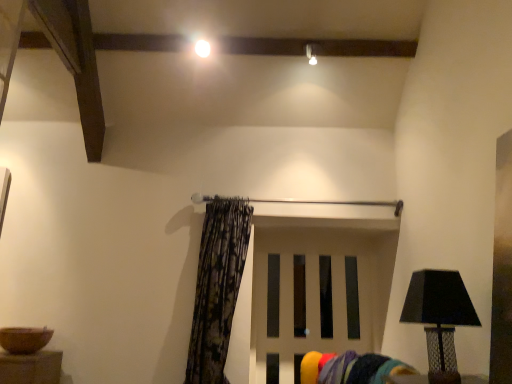
Question: Is black textured lamp at right turned away from velvet yellow swivel chair at lower center?

Choices:
 (A) yes
 (B) no

Answer: (B)

Question: From the image's perspective, is black textured lamp at right under velvet yellow swivel chair at lower center?

Choices:
 (A) no
 (B) yes

Answer: (A)

Question: Considering the relative sizes of black textured lamp at right and velvet yellow swivel chair at lower center in the image provided, is black textured lamp at right shorter than velvet yellow swivel chair at lower center?

Choices:
 (A) yes
 (B) no

Answer: (B)

Question: Considering the relative positions of black textured lamp at right and velvet yellow swivel chair at lower center in the image provided, is black textured lamp at right behind velvet yellow swivel chair at lower center?

Choices:
 (A) no
 (B) yes

Answer: (A)

Question: From a real-world perspective, is black textured lamp at right located higher than velvet yellow swivel chair at lower center?

Choices:
 (A) yes
 (B) no

Answer: (A)

Question: From a real-world perspective, is white matte door at center physically located above or below printed fabric curtain at center?

Choices:
 (A) below
 (B) above

Answer: (A)

Question: Looking at the image, does white matte door at center seem bigger or smaller compared to printed fabric curtain at center?

Choices:
 (A) small
 (B) big

Answer: (A)

Question: Considering the positions of white matte door at center and printed fabric curtain at center in the image, is white matte door at center taller or shorter than printed fabric curtain at center?

Choices:
 (A) tall
 (B) short

Answer: (B)

Question: Visually, is white matte door at center positioned to the left or to the right of printed fabric curtain at center?

Choices:
 (A) left
 (B) right

Answer: (B)

Question: In the image, is printed fabric curtain at center positioned in front of or behind velvet yellow swivel chair at lower center?

Choices:
 (A) front
 (B) behind

Answer: (B)

Question: Would you say printed fabric curtain at center is inside or outside velvet yellow swivel chair at lower center?

Choices:
 (A) outside
 (B) inside

Answer: (A)

Question: From a real-world perspective, is printed fabric curtain at center physically located above or below velvet yellow swivel chair at lower center?

Choices:
 (A) below
 (B) above

Answer: (B)

Question: Is point (205, 215) positioned closer to the camera than point (401, 367)?

Choices:
 (A) closer
 (B) farther

Answer: (B)

Question: From a real-world perspective, is white glossy light bulb at upper center positioned above or below printed fabric curtain at center?

Choices:
 (A) below
 (B) above

Answer: (B)

Question: Is white glossy light bulb at upper center inside the boundaries of printed fabric curtain at center, or outside?

Choices:
 (A) inside
 (B) outside

Answer: (B)